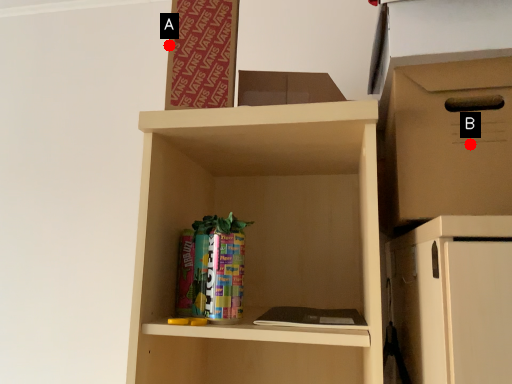
Question: Two points are circled on the image, labeled by A and B beside each circle. Which point is farther from the camera taking this photo?

Choices:
 (A) A is further
 (B) B is further

Answer: (A)